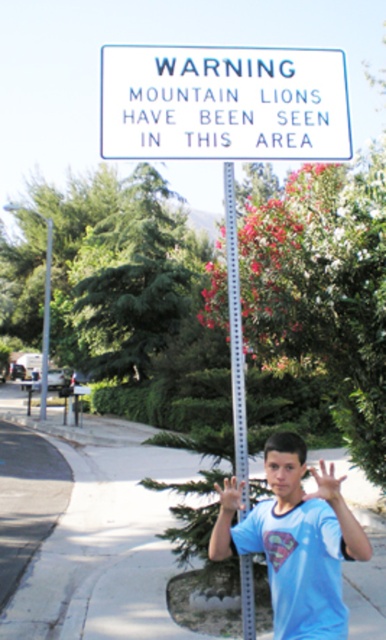
You are a delivery robot trying to navigate the sidewalk. The silver metallic pole at center is blocking your path. Can you go around it by moving along the paved concrete sidewalk at lower center?

The paved concrete sidewalk at lower center is not as tall as the silver metallic pole at center, so the robot can go around the pole by moving along the sidewalk since the sidewalk is lower and not obstructing the path.

You are a delivery driver who needs to deliver a package to a house located near the white plastic sign at upper center. The GPS shows the sign is at coordinates 0.163, 0.580. Can you use this information to navigate to the sign?

The white plastic sign at upper center is located at coordinates (x=223, y=104), so yes, you can use this information to navigate to the sign by inputting those coordinates into your GPS system.